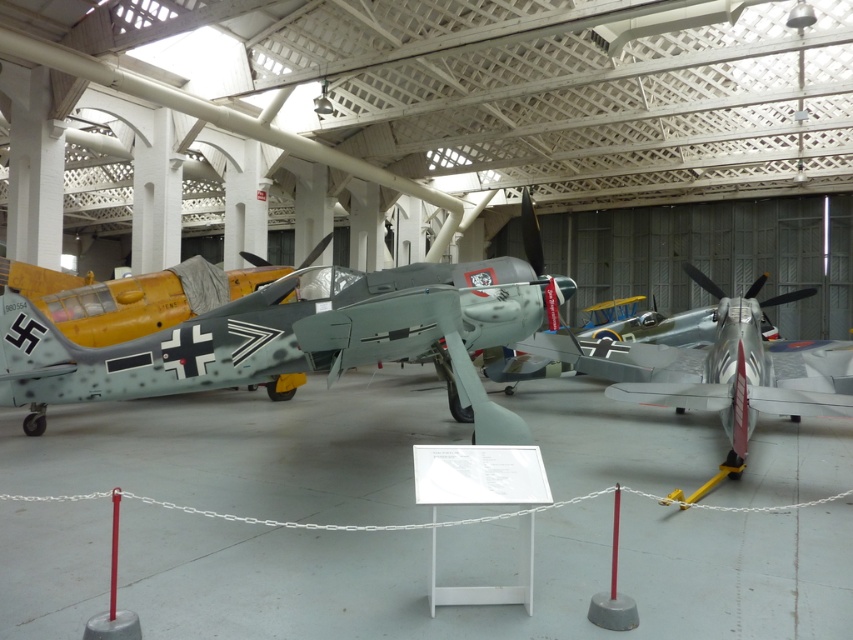
Question: Is silver metallic airplane at center below camouflage paint airplane at left?

Choices:
 (A) no
 (B) yes

Answer: (B)

Question: Which point is farther to the camera?

Choices:
 (A) camouflage paint airplane at left
 (B) silver metallic airplane at center

Answer: (A)

Question: Where is silver metallic airplane at center located in relation to camouflage paint airplane at left in the image?

Choices:
 (A) right
 (B) left

Answer: (A)

Question: Is silver metallic airplane at center to the right of camouflage paint airplane at left from the viewer's perspective?

Choices:
 (A) no
 (B) yes

Answer: (B)